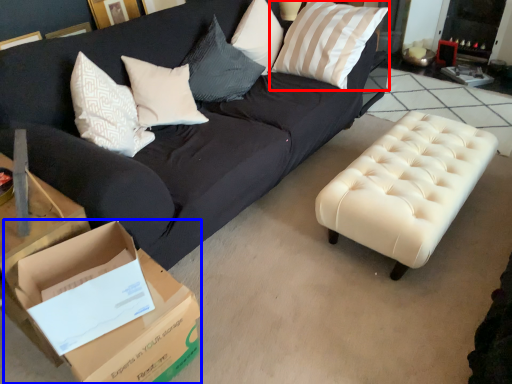
Question: Which of the following is the farthest to the observer, pillow (highlighted by a red box) or cardboard box (highlighted by a blue box)?

Choices:
 (A) pillow
 (B) cardboard box

Answer: (A)